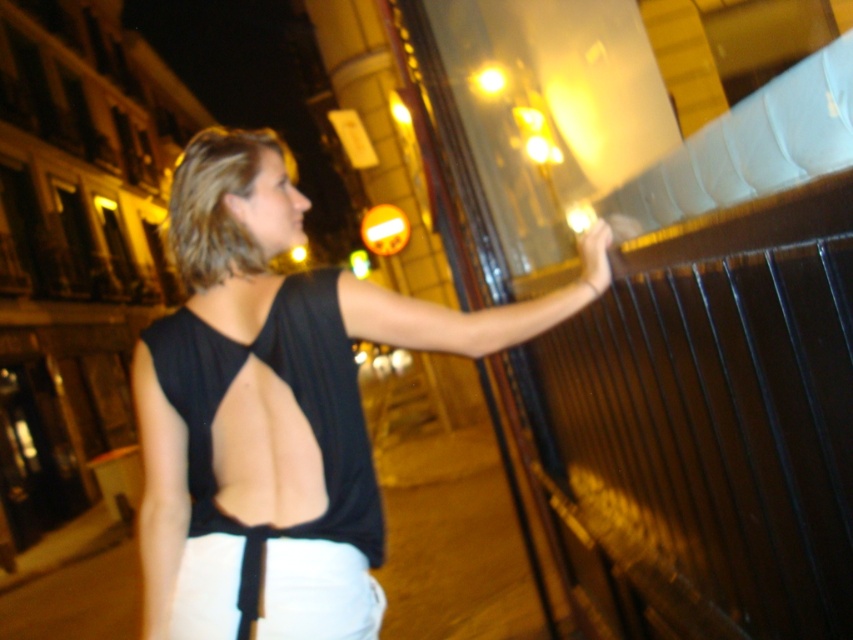
You are a photographer trying to capture the person in the scene. You notice the black matte tank top at center and the matte black hand at upper right. Which object should you focus on first to ensure it appears sharp in your photo?

You should focus on the black matte tank top at center first because it is closer to the viewer than the matte black hand at upper right, so it requires a different focal plane.

You are a fashion designer analyzing the image. You need to determine if the black matte tank top at center can be worn with a bracelet that requires 15 cm of space on the wrist. The matte black hand at upper right is 12 cm in width. Can the bracelet fit?

The black matte tank top at center has a larger size compared to the matte black hand at upper right, but the hand is only 12 cm wide. Since the bracelet requires 15 cm of space, it won